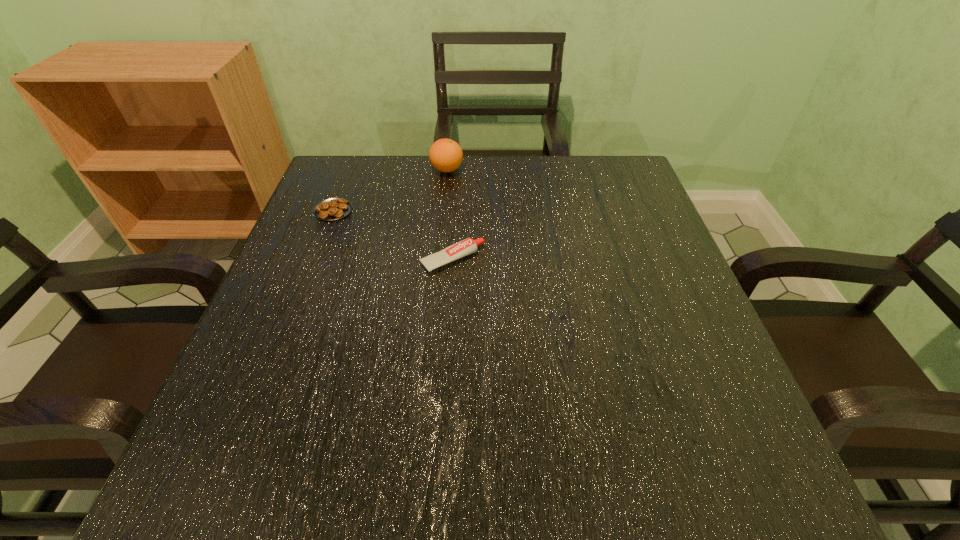
Select which object is the second closest to the farthest object. Please provide its 2D coordinates. Your answer should be formatted as a tuple, i.e. [(x, y)], where the tuple contains the x and y coordinates of a point satisfying the conditions above.

[(468, 246)]

Identify the location of object that is the second closest one to the farthest object. (468, 246).

This screenshot has width=960, height=540. I want to click on vacant space that satisfies the following two spatial constraints: 1. on the front side of the orange; 2. on the right side of the toothpaste, so tap(438, 260).

Find the location of a particular element. The image size is (960, 540). free spot that satisfies the following two spatial constraints: 1. on the back side of the tallest object; 2. on the left side of the second nearest object is located at coordinates (349, 170).

This screenshot has width=960, height=540. In order to click on free location that satisfies the following two spatial constraints: 1. on the front side of the farthest object; 2. on the right side of the second tallest object in this screenshot , I will do `click(438, 260)`.